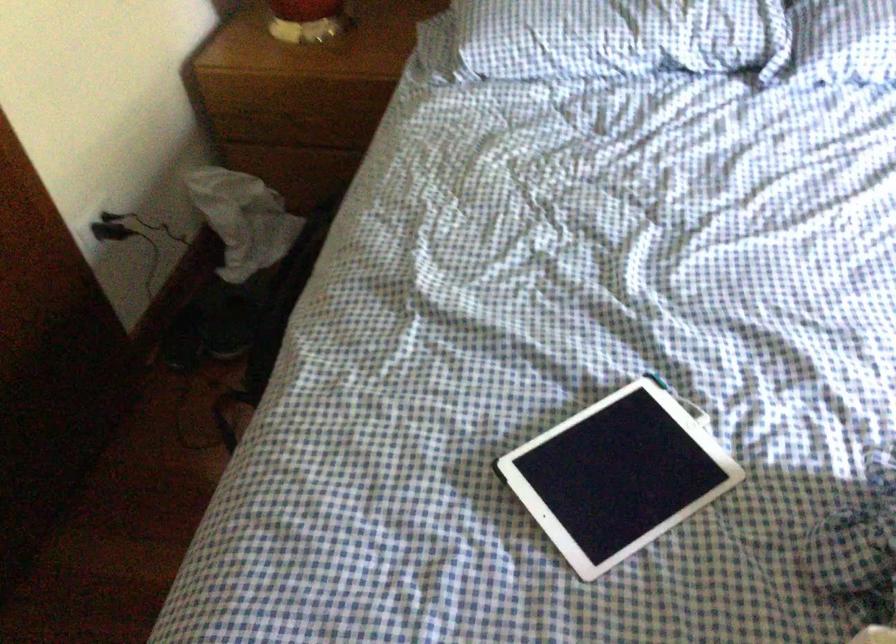
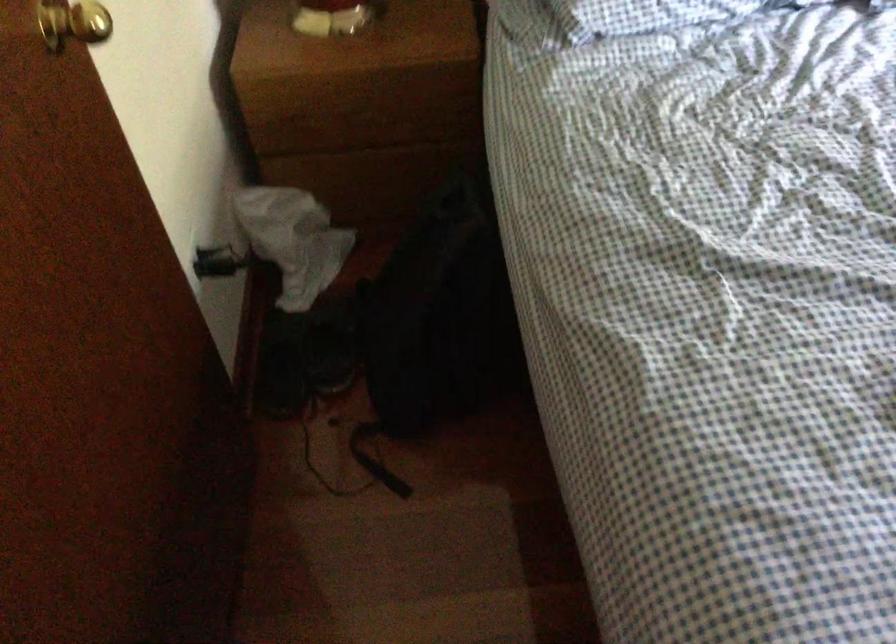
Locate, in the second image, the point that corresponds to (242,317) in the first image.

(332, 345)